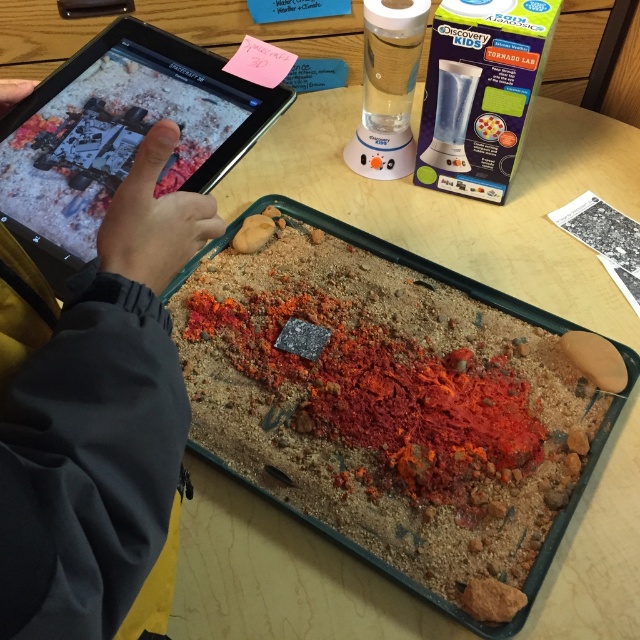
Question: From the image, what is the correct spatial relationship of gray fabric hand at upper left in relation to black glossy tablet at upper left?

Choices:
 (A) left
 (B) right

Answer: (B)

Question: Can you confirm if gray fabric hand at upper left is positioned to the left of granular sand tray at center?

Choices:
 (A) no
 (B) yes

Answer: (B)

Question: Can you confirm if gray fabric hand at upper left is thinner than granular sand tray at center?

Choices:
 (A) yes
 (B) no

Answer: (A)

Question: Which point appears closest to the camera in this image?

Choices:
 (A) (493, 630)
 (B) (88, 173)

Answer: (B)

Question: Which of the following is the farthest from the observer?

Choices:
 (A) (104, 236)
 (B) (52, 176)
 (C) (536, 563)

Answer: (C)

Question: Estimate the real-world distances between objects in this image. Which object is farther from the gray fabric hand at upper left?

Choices:
 (A) black glossy tablet at upper left
 (B) granular sand tray at center

Answer: (B)